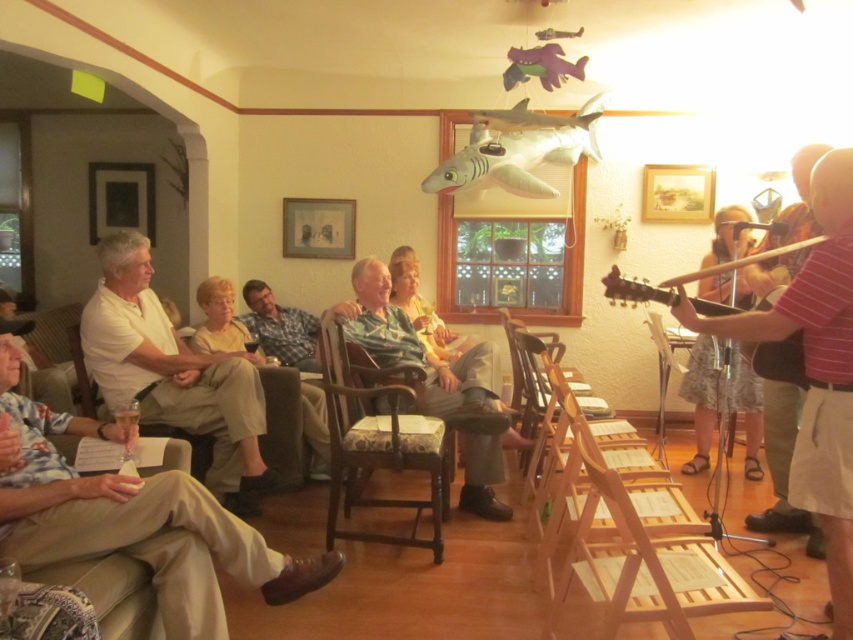
Question: Which point is closer to the camera?

Choices:
 (A) (646, 212)
 (B) (96, 166)

Answer: (A)

Question: Which object appears closest to the camera in this image?

Choices:
 (A) wooden picture frame at upper center
 (B) fabric upholstered chair at center

Answer: (B)

Question: Observing the image, what is the correct spatial positioning of fabric upholstered chair at center in reference to matte silver picture frame at center?

Choices:
 (A) below
 (B) above

Answer: (A)

Question: Among these objects, which one is nearest to the camera?

Choices:
 (A) brown wooden guitar at right
 (B) matte silver picture frame at center
 (C) wooden armchair at lower left

Answer: (A)

Question: From the image, what is the correct spatial relationship of fabric upholstered chair at center in relation to wooden picture frame at upper center?

Choices:
 (A) left
 (B) right

Answer: (A)

Question: Does matte silver picture frame at center have a larger size compared to wooden armchair at lower left?

Choices:
 (A) no
 (B) yes

Answer: (A)